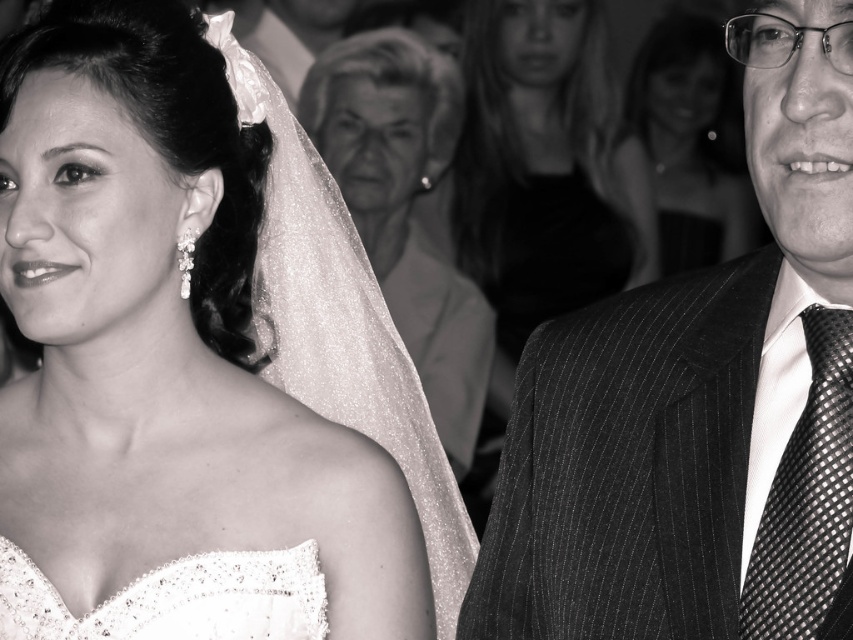
You are a photographer trying to capture a closeup shot of the bride. You notice the glittery white veil at center and the smooth skin face at upper right. Which object takes up more space in the photo?

The glittery white veil at center takes up more space in the photo because its width is larger than that of the smooth skin face at upper right.

You are a photographer at a wedding and need to adjust the lighting so that both the matte white dress at left and the smooth silk dress at center are equally visible. Given their height difference, which dress might require more lighting adjustments?

The matte white dress at left has a lesser height compared to the smooth silk dress at center, so it might require more lighting adjustments to ensure visibility since it is shorter and might not catch as much light as the taller dress.

You are a photographer adjusting the camera focus. The matte white dress at left is your main subject. Where should you position the focus point to ensure the dress is sharply in focus?

You should position the focus point at coordinates (164, 333) to ensure the matte white dress at left is sharply in focus.